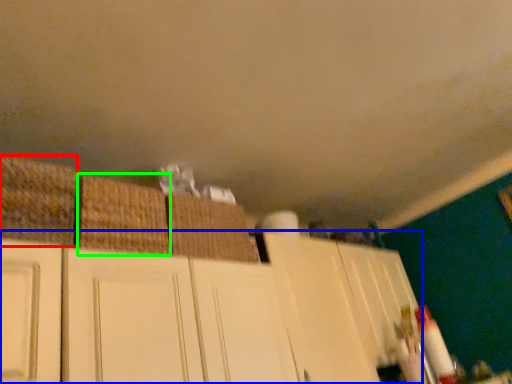
Question: Estimate the real-world distances between objects in this image. Which object is farther from basket (highlighted by a red box), cabinetry (highlighted by a blue box) or basket (highlighted by a green box)?

Choices:
 (A) cabinetry
 (B) basket

Answer: (A)